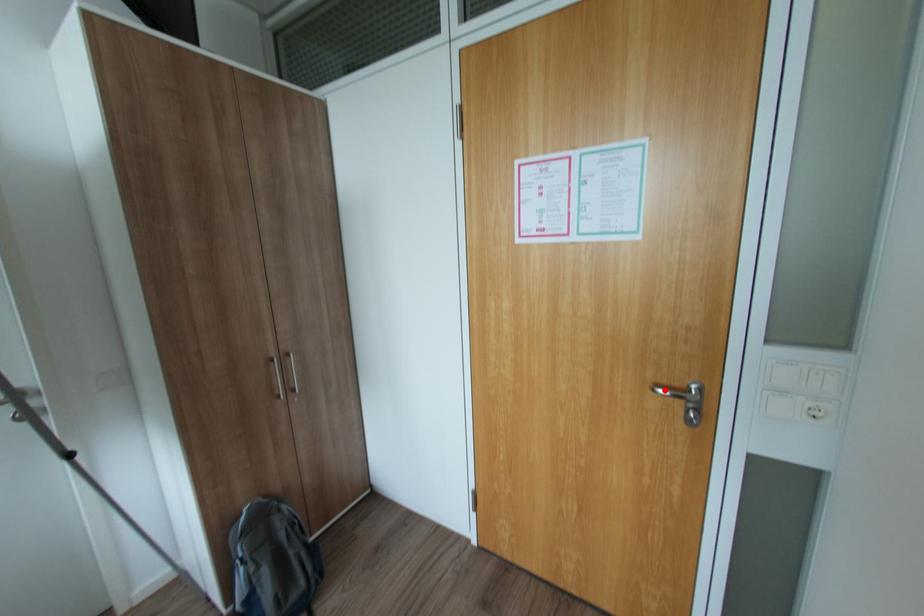
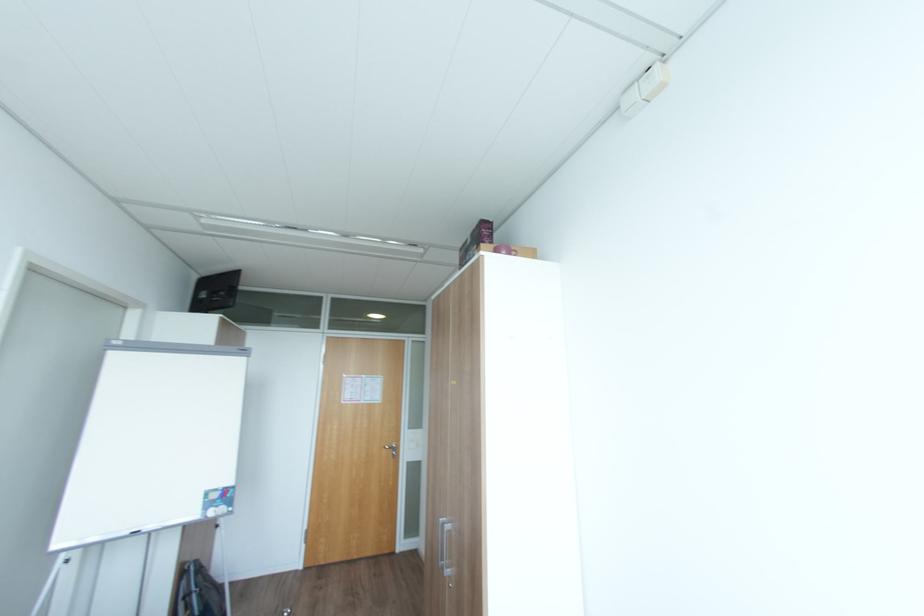
Question: A red point is marked in image1. In image2, is the corresponding 3D point closer to the camera or farther? Reply with the corresponding letter.

Choices:
 (A) The corresponding 3D point is closer.
 (B) The corresponding 3D point is farther.

Answer: (B)